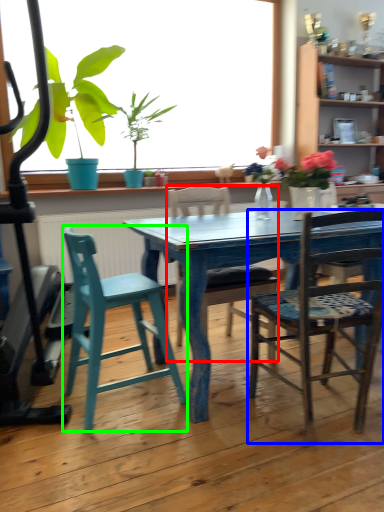
Question: Considering the real-world distances, which object is farthest from chair (highlighted by a red box)? chair (highlighted by a blue box) or chair (highlighted by a green box)?

Choices:
 (A) chair
 (B) chair

Answer: (B)